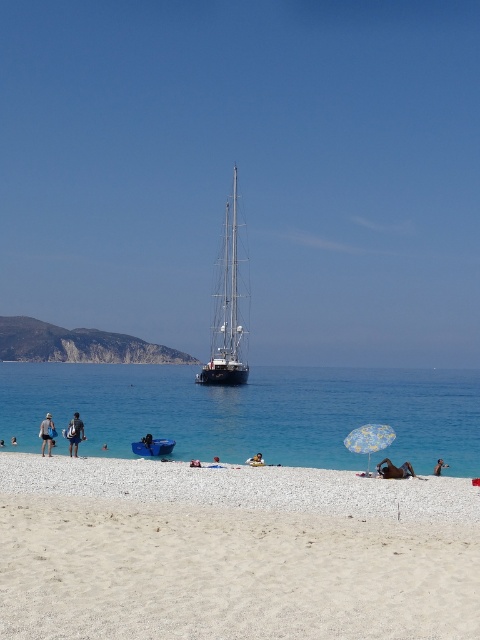
Can you confirm if khaki shorts at center is thinner than dark blue fabric at center?

No.

Between khaki shorts at center and dark blue fabric at center, which one has less height?

dark blue fabric at center

Image resolution: width=480 pixels, height=640 pixels. Identify the location of khaki shorts at center. (47, 433).

Can you confirm if yellow printed fabric umbrella at lower right is wider than dark blue fabric at center?

Yes.

Does yellow printed fabric umbrella at lower right appear on the right side of dark blue fabric at center?

Indeed, yellow printed fabric umbrella at lower right is positioned on the right side of dark blue fabric at center.

Between point (382, 448) and point (147, 445), which one is positioned in front?

Positioned in front is point (382, 448).

Locate an element on the screen. Image resolution: width=480 pixels, height=640 pixels. yellow printed fabric umbrella at lower right is located at coordinates (369, 438).

Can you confirm if silver metallic sailboat at center is positioned to the right of dark blue fabric umbrella at lower right?

Incorrect, silver metallic sailboat at center is not on the right side of dark blue fabric umbrella at lower right.

What do you see at coordinates (227, 310) in the screenshot? The height and width of the screenshot is (640, 480). I see `silver metallic sailboat at center` at bounding box center [227, 310].

At what (x,y) coordinates should I click in order to perform the action: click on silver metallic sailboat at center. Please return your answer as a coordinate pair (x, y). Looking at the image, I should click on (227, 310).

In order to click on silver metallic sailboat at center in this screenshot , I will do `click(227, 310)`.